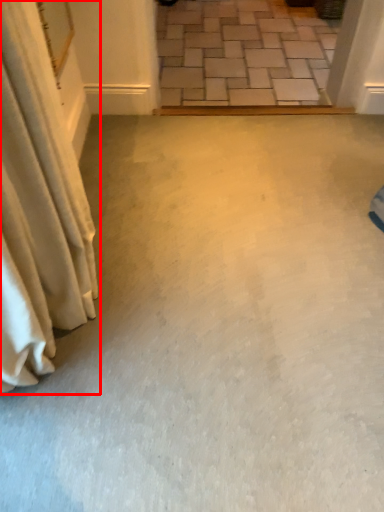
Question: From the image, what is the correct spatial relationship of curtain (annotated by the red box) in relation to concrete?

Choices:
 (A) left
 (B) right

Answer: (A)